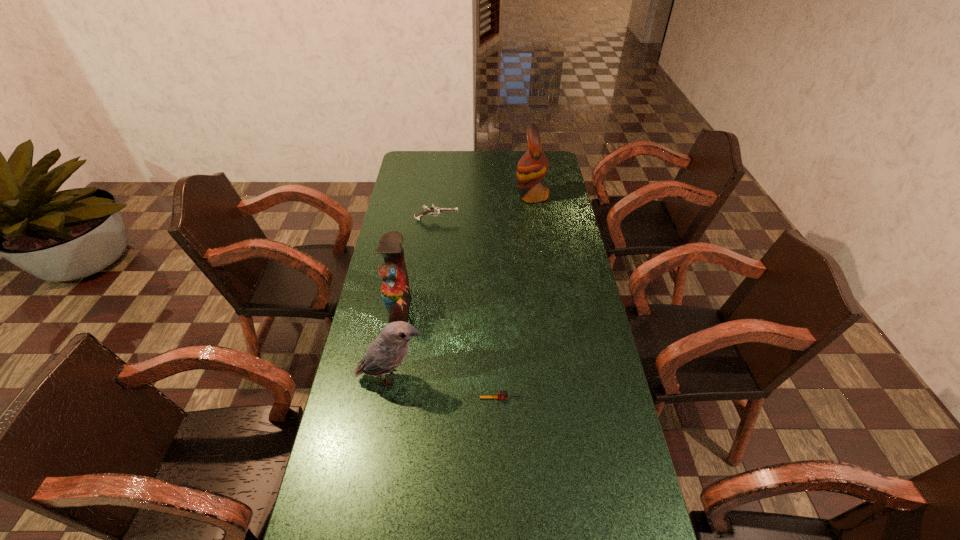
This screenshot has height=540, width=960. What are the coordinates of `the tallest object` in the screenshot? It's located at (533, 165).

I want to click on the rightmost parrot, so click(x=533, y=165).

The height and width of the screenshot is (540, 960). Identify the location of the second farthest parrot. (395, 290).

I want to click on the nearest parrot, so click(x=389, y=349).

Find the location of a particular element. the second farthest object is located at coordinates (435, 210).

Where is `gun`? gun is located at coordinates (435, 210).

At what (x,y) coordinates should I click in order to perform the action: click on the nearest object. Please return your answer as a coordinate pair (x, y). The image size is (960, 540). Looking at the image, I should click on 500,394.

The height and width of the screenshot is (540, 960). I want to click on the second object from right to left, so click(x=500, y=394).

Find the location of `free location located on the face of the tallest object`. free location located on the face of the tallest object is located at coordinates (502, 196).

You are a GUI agent. You are given a task and a screenshot of the screen. Output one action in this format:
    pyautogui.click(x=<x>, y=<y>)
    Task: Click on the free space located on the face of the tallest object
    This screenshot has height=540, width=960.
    Given the screenshot: What is the action you would take?
    pyautogui.click(x=483, y=196)